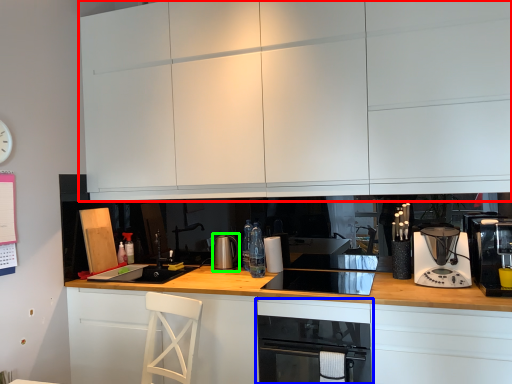
Question: Which object is the closest to the cabinetry (highlighted by a red box)? Choose among these: home appliance (highlighted by a blue box) or kitchen appliance (highlighted by a green box).

Choices:
 (A) home appliance
 (B) kitchen appliance

Answer: (A)